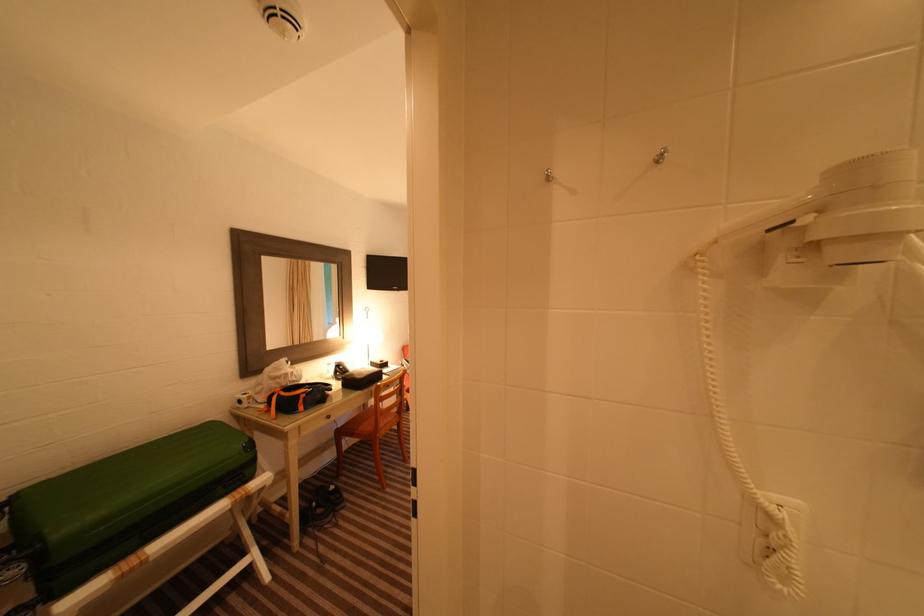
The height and width of the screenshot is (616, 924). Describe the element at coordinates (368, 426) in the screenshot. I see `the chair sitting surface` at that location.